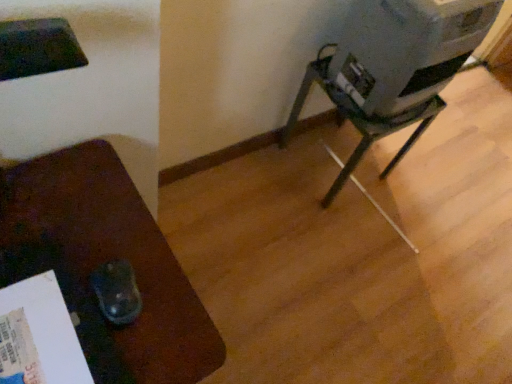
Identify the location of blank space situated above matte brown mouse pad at left, the first furniture viewed from the left (from a real-world perspective). (92, 259).